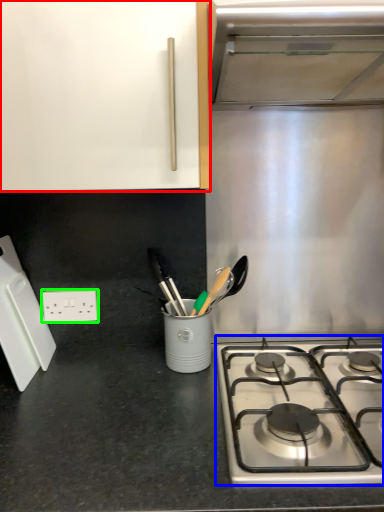
Question: Considering the real-world distances, which object is farthest from cabinetry (highlighted by a red box)? gas stove (highlighted by a blue box) or electric outlet (highlighted by a green box)?

Choices:
 (A) gas stove
 (B) electric outlet

Answer: (A)